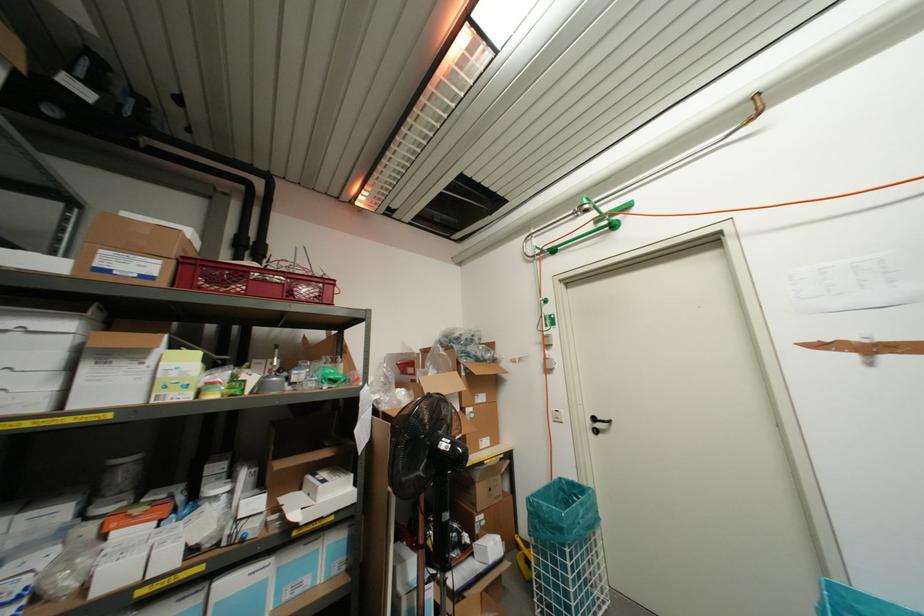
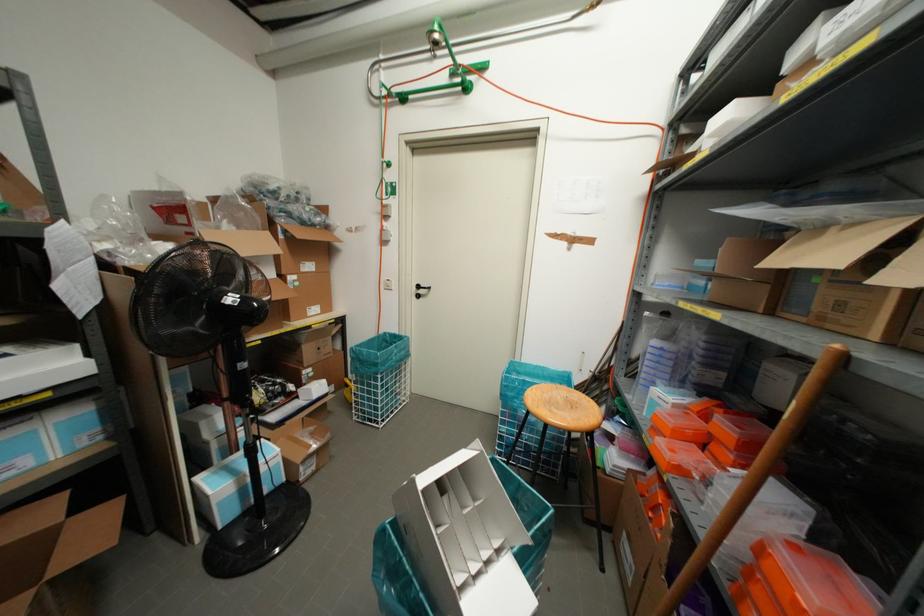
The point at (597, 424) is marked in the first image. Where is the corresponding point in the second image?

(419, 291)